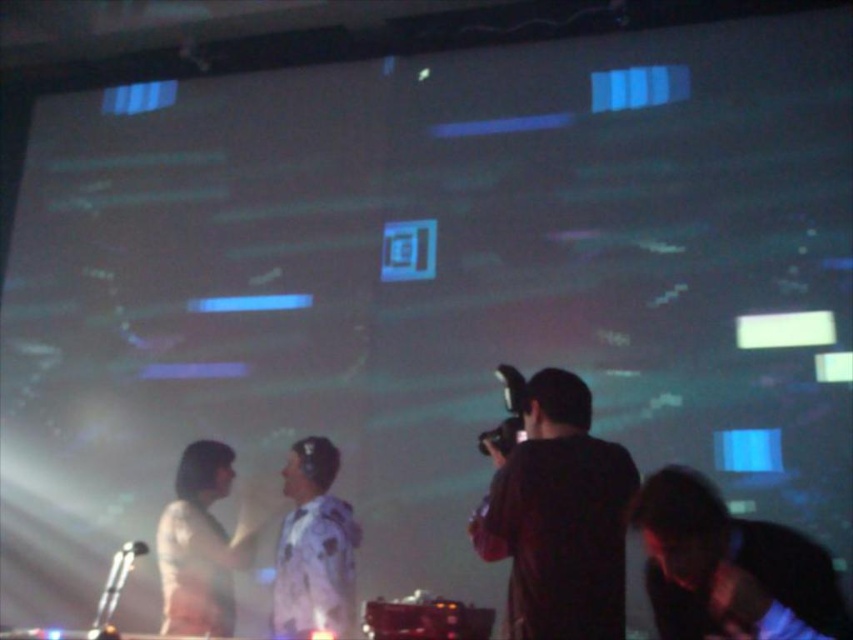
Question: Which point is closer to the camera taking this photo?

Choices:
 (A) (689, 477)
 (B) (563, 458)

Answer: (B)

Question: Can you confirm if black matte camera at center is bigger than black matte camera at lower right?

Choices:
 (A) yes
 (B) no

Answer: (B)

Question: Which point appears farthest from the camera in this image?

Choices:
 (A) (672, 612)
 (B) (590, 588)
 (C) (350, 564)
 (D) (165, 576)

Answer: (D)

Question: Can you confirm if black matte camera at lower right is positioned to the right of white matte shirt at center?

Choices:
 (A) yes
 (B) no

Answer: (A)

Question: Which point is closer to the camera taking this photo?

Choices:
 (A) (585, 552)
 (B) (323, 456)
 (C) (718, 500)

Answer: (A)

Question: From the image, what is the correct spatial relationship of white matte jacket at center in relation to white matte shirt at center?

Choices:
 (A) right
 (B) left

Answer: (A)